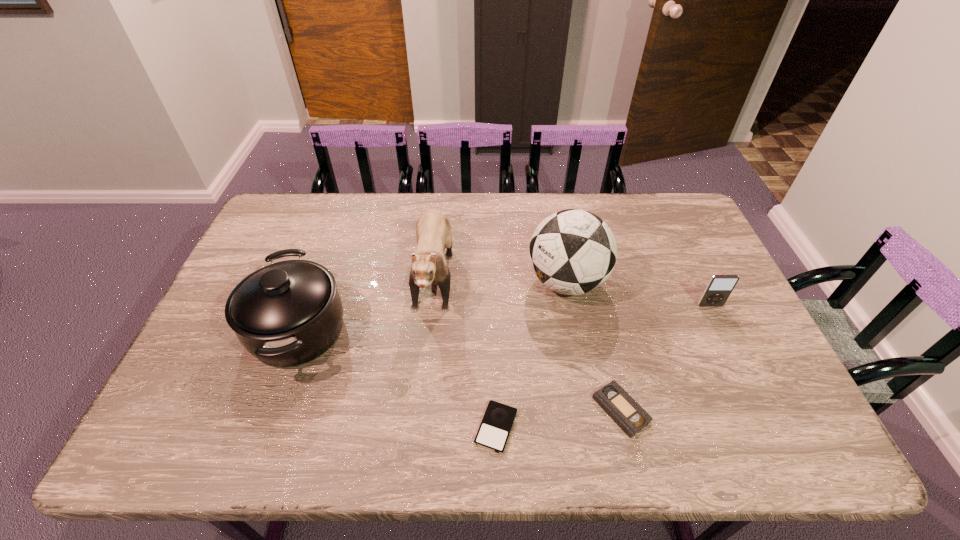
You are a GUI agent. You are given a task and a screenshot of the screen. Output one action in this format:
    pyautogui.click(x=<x>, y=<y>)
    Task: Click on the soccer ball
    The width and height of the screenshot is (960, 540).
    Given the screenshot: What is the action you would take?
    pyautogui.click(x=572, y=252)

You are a GUI agent. You are given a task and a screenshot of the screen. Output one action in this format:
    pyautogui.click(x=<x>, y=<y>)
    Task: Click on the ferret
    
    Given the screenshot: What is the action you would take?
    pyautogui.click(x=433, y=230)

What are the coordinates of `the leftmost object` in the screenshot? It's located at (288, 313).

I want to click on the right iPod, so click(719, 287).

The height and width of the screenshot is (540, 960). I want to click on the fourth tallest object, so pos(719,287).

Find the location of a particular element. the second shortest object is located at coordinates (613, 399).

I want to click on the third object from left to right, so (x=493, y=433).

I want to click on the left iPod, so click(493, 433).

This screenshot has width=960, height=540. I want to click on free spot located on the surface of the soccer ball where the brand logo is visible, so click(x=473, y=282).

Where is `vacant region located on the surface of the soccer ball where the brand logo is visible`? The width and height of the screenshot is (960, 540). vacant region located on the surface of the soccer ball where the brand logo is visible is located at coordinates (431, 282).